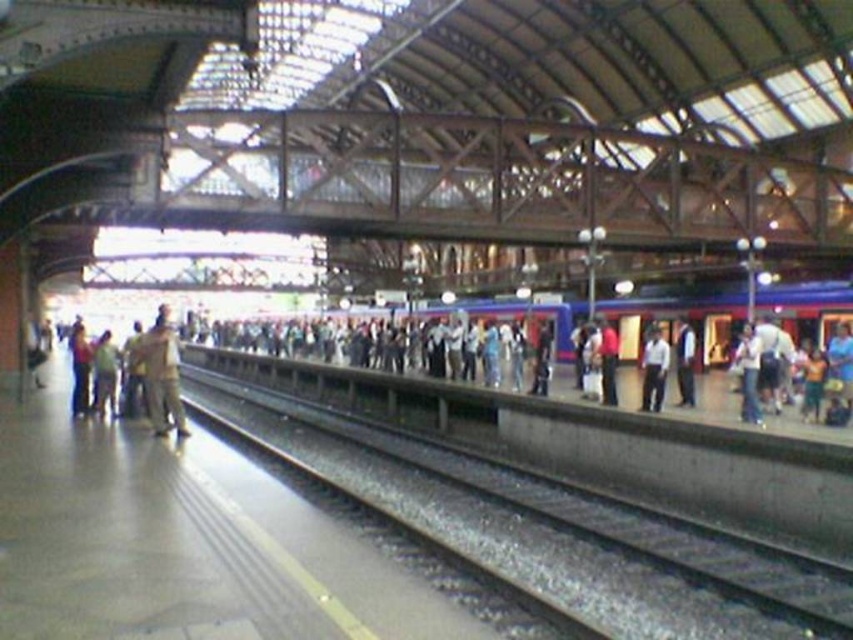
Question: Which of the following is the closest to the observer?

Choices:
 (A) (606, 396)
 (B) (721, 314)
 (C) (798, 573)

Answer: (C)

Question: Which object is closer to the camera taking this photo?

Choices:
 (A) dark blue shirt at center
 (B) black metal train track at center
 (C) blue metallic train at center

Answer: (B)

Question: Considering the real-world distances, which object is closest to the blue metallic train at center?

Choices:
 (A) jeans at right
 (B) red shirt at right
 (C) camouflage fabric jacket at center

Answer: (B)

Question: Can you confirm if dark blue shirt at center is wider than red shirt at right?

Choices:
 (A) yes
 (B) no

Answer: (A)

Question: Is white shirt at center bigger than dark blue shirt at center?

Choices:
 (A) yes
 (B) no

Answer: (A)

Question: Is camouflage fabric jacket at center below white shirt at center?

Choices:
 (A) no
 (B) yes

Answer: (A)